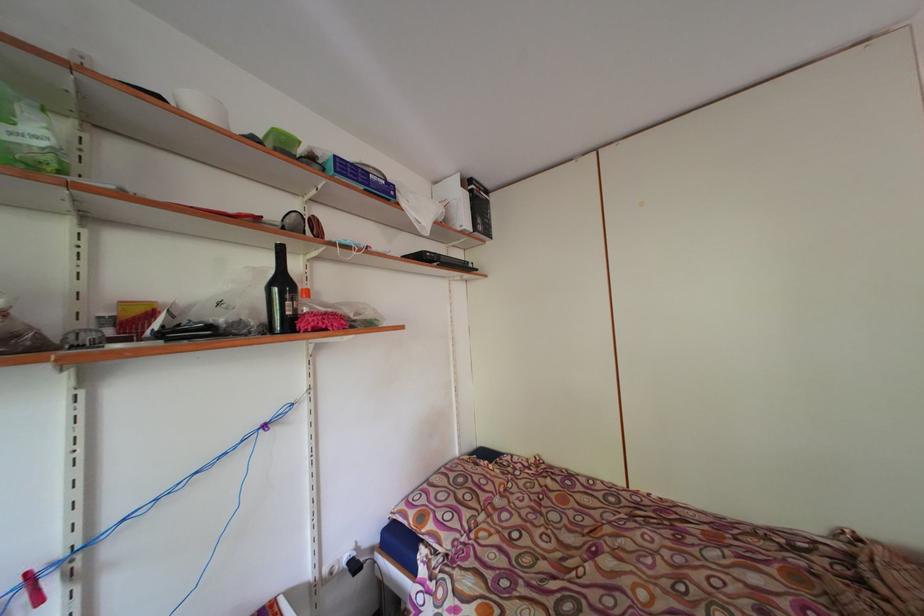
Where is `pair of sunglasses`? pair of sunglasses is located at coordinates (301, 224).